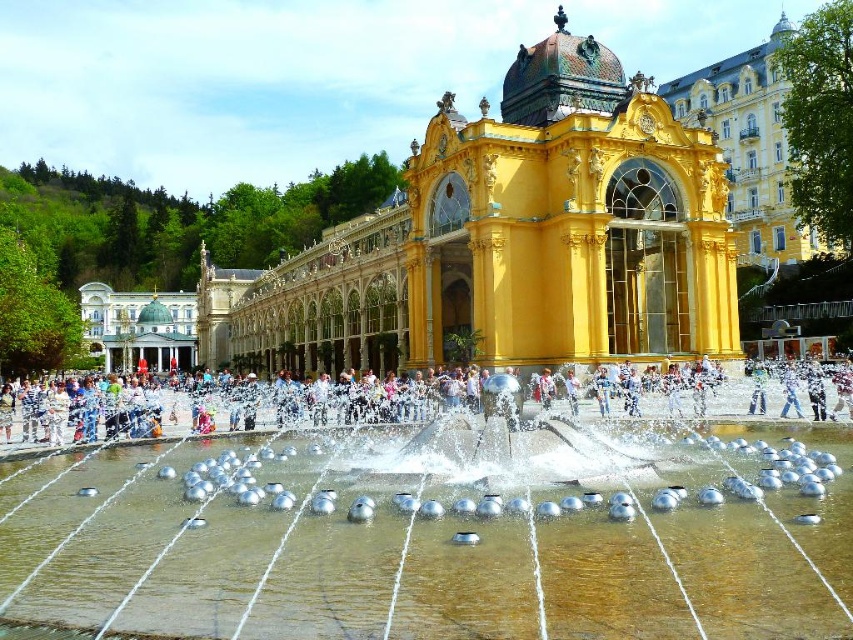
Can you confirm if silver metallic water at center is bigger than golden glass palace at center?

No, silver metallic water at center is not bigger than golden glass palace at center.

Can you confirm if silver metallic water at center is wider than golden glass palace at center?

In fact, silver metallic water at center might be narrower than golden glass palace at center.

This screenshot has height=640, width=853. Find the location of `silver metallic water at center`. silver metallic water at center is located at coordinates (434, 538).

From the picture: Can you confirm if golden glass palace at center is shorter than yellow/golden stone building at upper right?

Yes, golden glass palace at center is shorter than yellow/golden stone building at upper right.

Measure the distance from golden glass palace at center to yellow/golden stone building at upper right.

golden glass palace at center and yellow/golden stone building at upper right are 40.81 meters apart.

I want to click on golden glass palace at center, so click(509, 241).

Does silver metallic water at center have a lesser width compared to yellow/golden stone building at upper right?

Yes.

Does silver metallic water at center have a lesser height compared to yellow/golden stone building at upper right?

Correct, silver metallic water at center is not as tall as yellow/golden stone building at upper right.

Who is more forward, (241, 484) or (756, 97)?

Point (241, 484)

The height and width of the screenshot is (640, 853). In order to click on silver metallic water at center in this screenshot , I will do `click(434, 538)`.